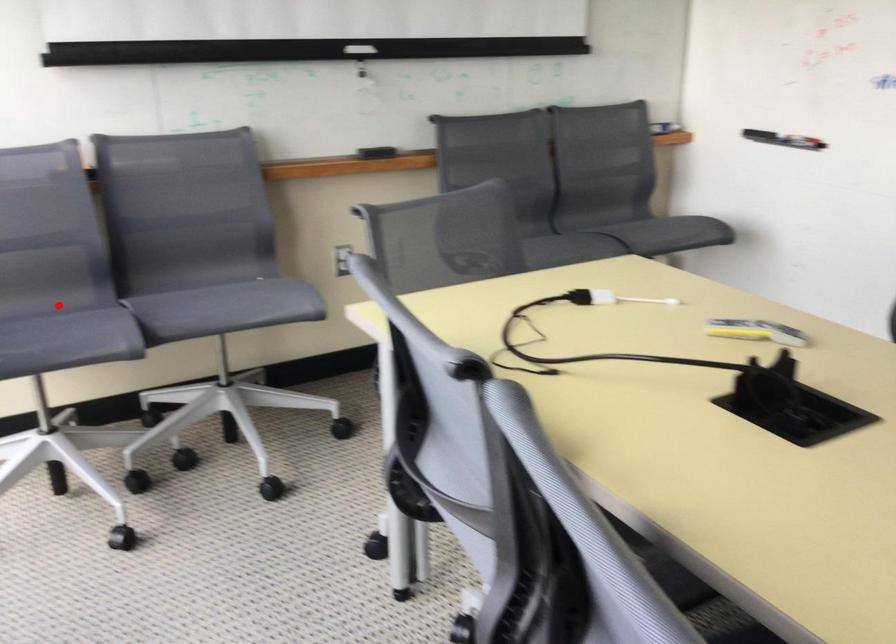
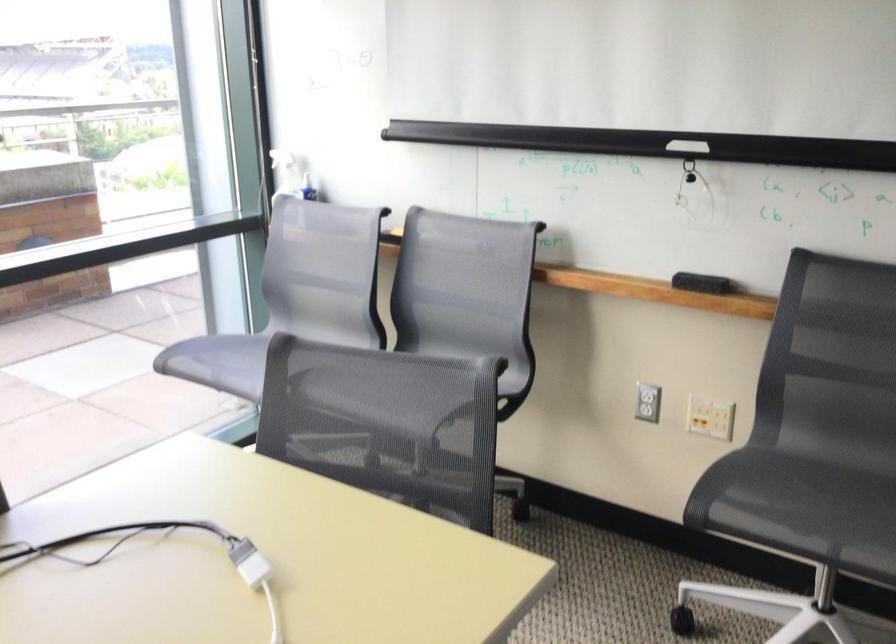
Question: I am providing you with two images of the same scene from different viewpoints. A red point is marked on the first image. Can you still see the location of the red point in image 2?

Choices:
 (A) Yes
 (B) No

Answer: (B)